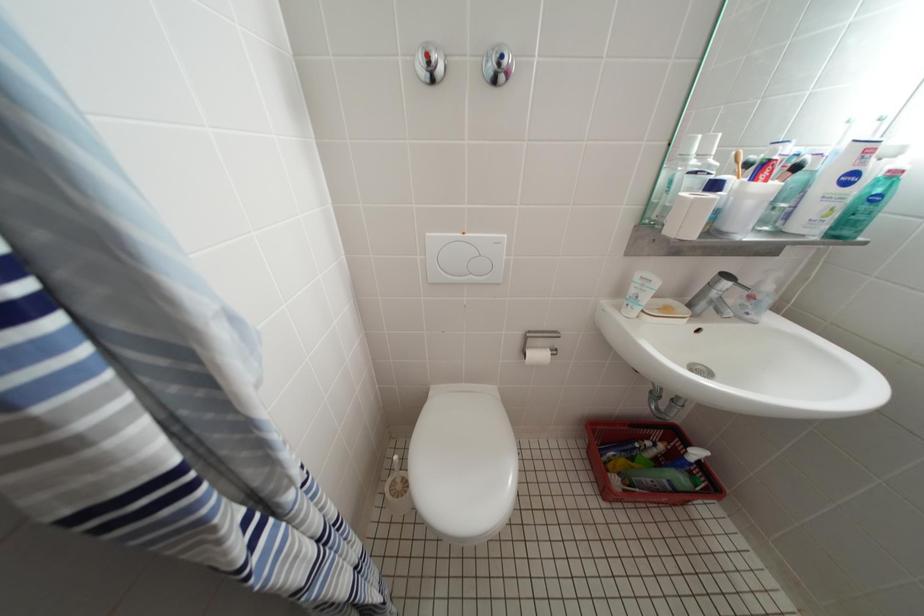
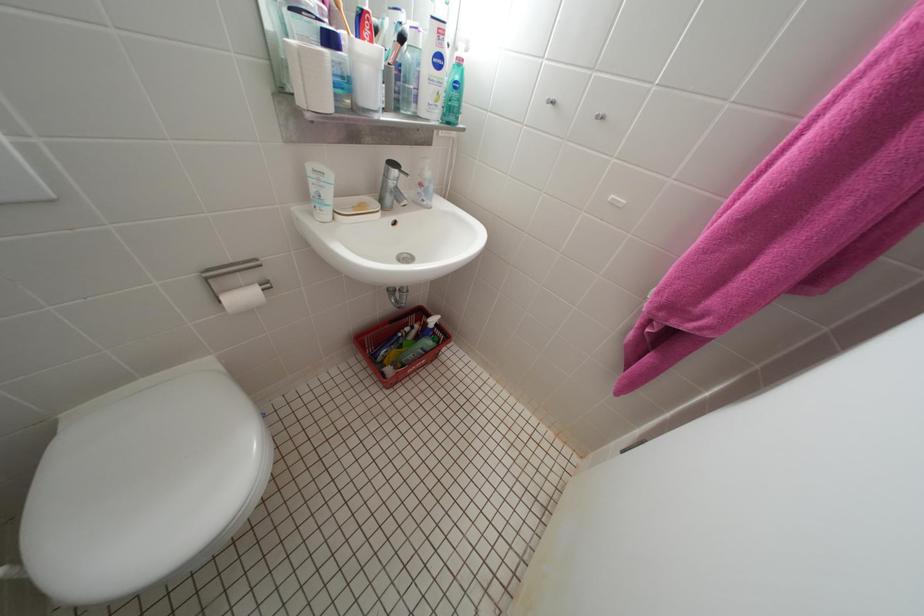
Based on the photo, the first image is from the beginning of the video and the second image is from the end. How did the camera likely rotate when shooting the video?

The rotation direction of the camera is right-down.